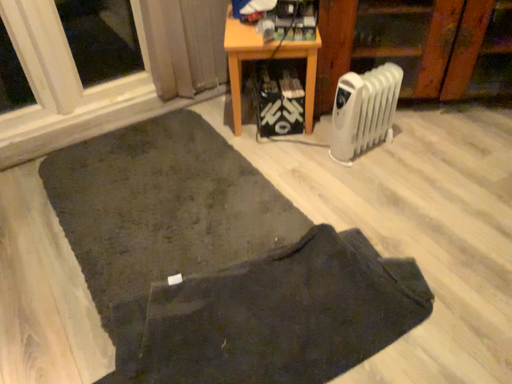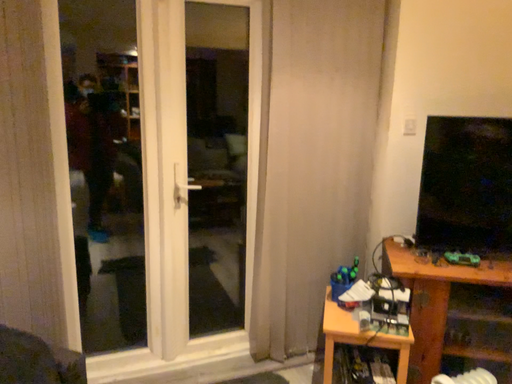
Question: Which way did the camera rotate in the video?

Choices:
 (A) rotated upward
 (B) rotated downward

Answer: (A)